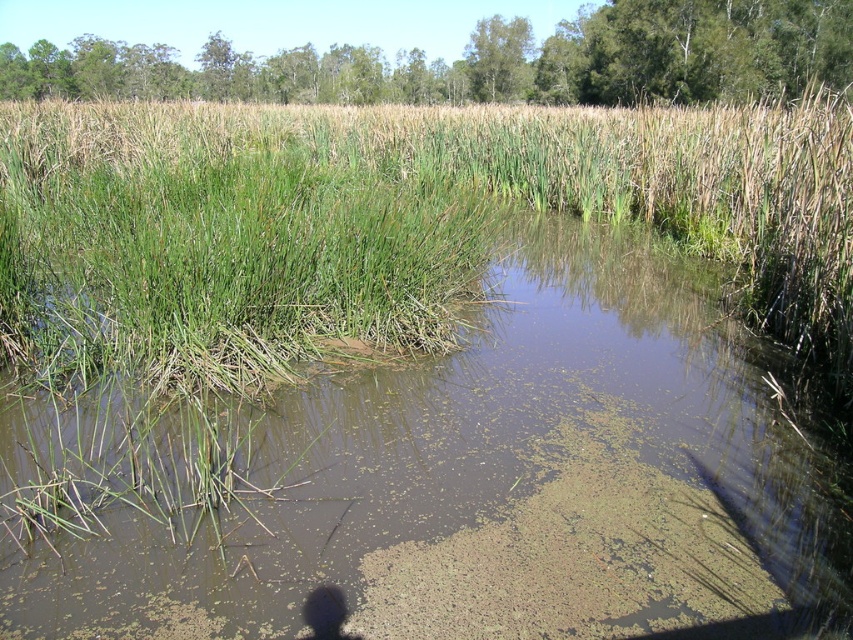
From the picture: You are a drone operator tasked with capturing aerial footage of the wetland. The brown murky water at center is your focal point. To ensure stability, your drone must hover directly above this area. What are the coordinates where you should position the drone?

The coordinates for the brown murky water at center are (492, 484), so you should position the drone directly above these coordinates to capture the focal point.

You are a frog looking for a place to rest. You see the brown murky water at center and the green grass at center. Which area would provide a larger resting spot?

The green grass at center occupies more space than the brown murky water at center, so the green grass at center would provide a larger resting spot.